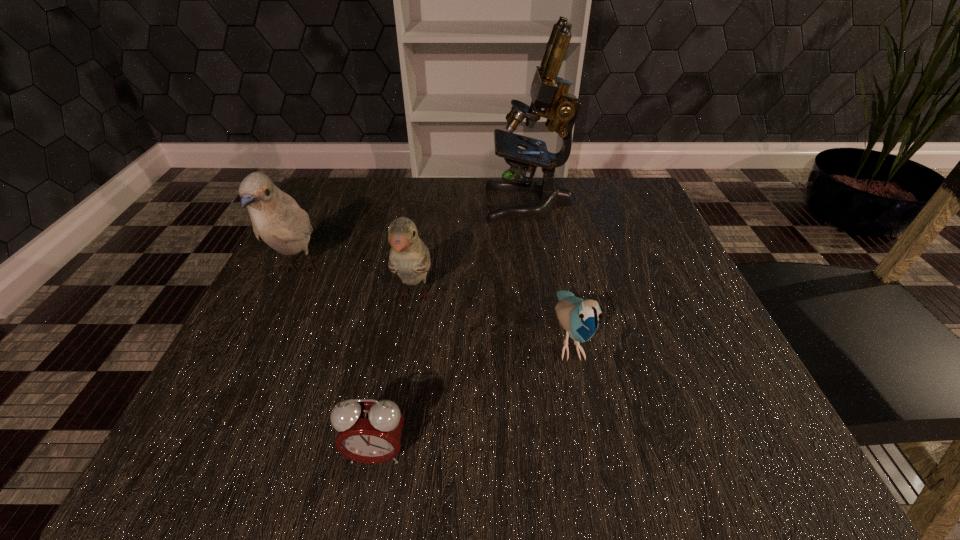
Find the location of a particular element. vacant space at the near edge is located at coordinates (644, 457).

At what (x,y) coordinates should I click in order to perform the action: click on vacant space at the left edge. Please return your answer as a coordinate pair (x, y). Looking at the image, I should click on (325, 292).

The image size is (960, 540). I want to click on vacant space at the right edge of the desktop, so click(x=661, y=242).

Locate an element on the screen. The height and width of the screenshot is (540, 960). vacant space at the far left corner of the desktop is located at coordinates (352, 194).

The width and height of the screenshot is (960, 540). Identify the location of free spot at the far right corner of the desktop. (630, 228).

This screenshot has width=960, height=540. Identify the location of free point between the nearest object and the third tallest object. (396, 376).

This screenshot has width=960, height=540. I want to click on free space between the rightmost bird and the shortest object, so click(473, 396).

At what (x,y) coordinates should I click in order to perform the action: click on vacant region between the third tallest object and the fourth tallest object. Please return your answer as a coordinate pair (x, y). The height and width of the screenshot is (540, 960). Looking at the image, I should click on (492, 319).

Find the location of a particular element. This screenshot has width=960, height=540. empty space between the third shortest object and the leftmost object is located at coordinates (357, 284).

This screenshot has height=540, width=960. What are the coordinates of `vacant space in between the microscope and the second bird from left to right` in the screenshot? It's located at (472, 251).